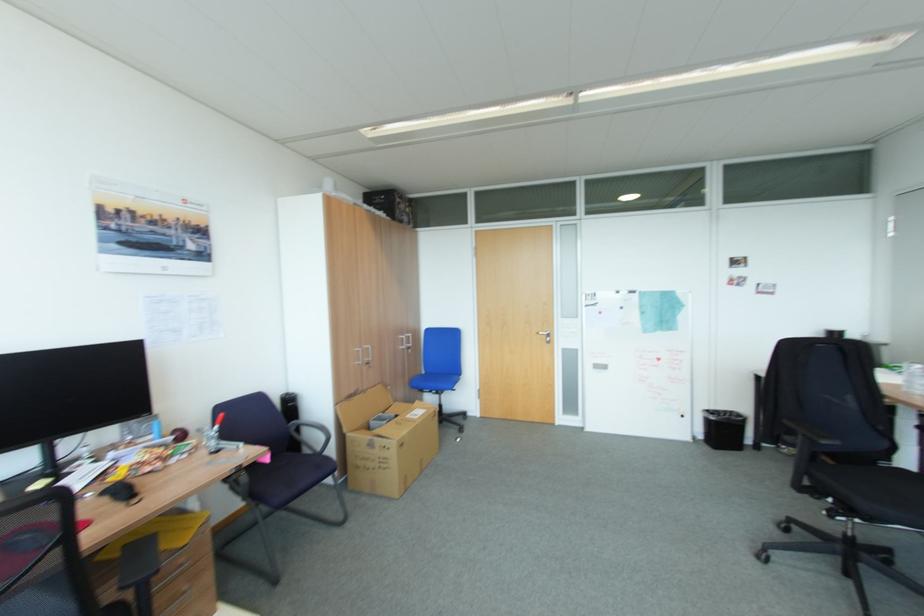
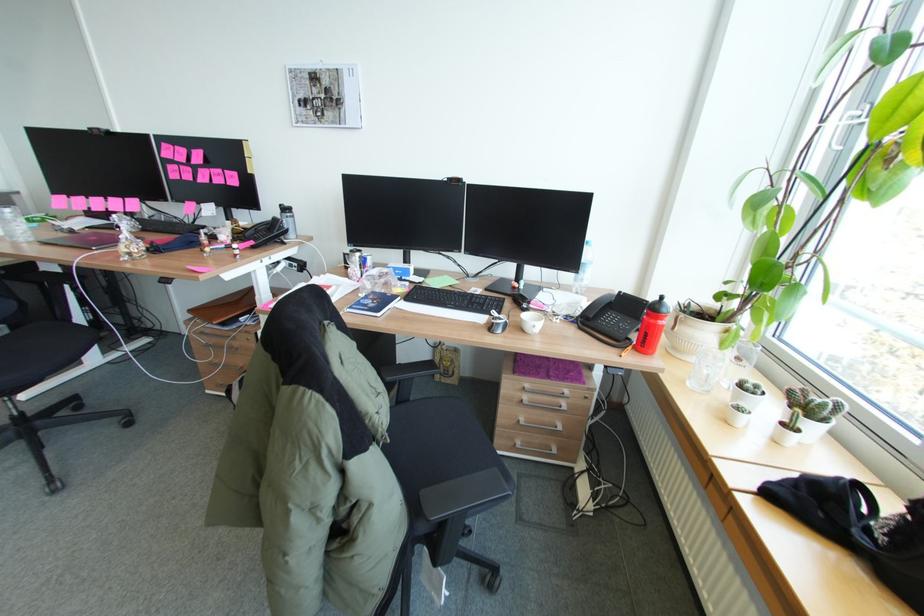
The images are taken continuously from a first-person perspective. In which direction is your viewpoint rotating?

The camera rotated toward right-down.